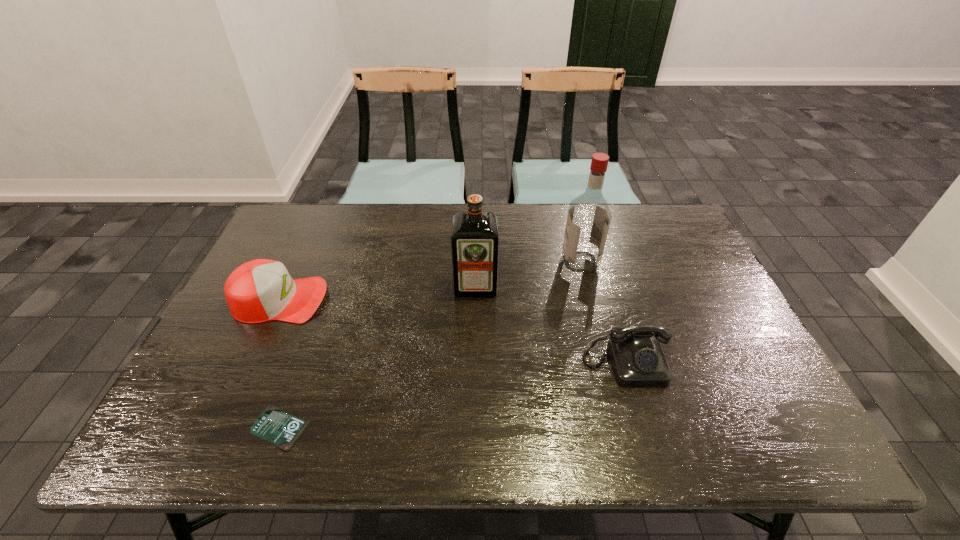
You are a GUI agent. You are given a task and a screenshot of the screen. Output one action in this format:
    pyautogui.click(x=<x>, y=<y>)
    Task: Click on the free spot located 0.240m on the front-facing side of the farthest object
    
    Given the screenshot: What is the action you would take?
    pyautogui.click(x=484, y=261)

Find the location of a particular element. This screenshot has width=960, height=540. vacant area situated 0.380m on the front-facing side of the farthest object is located at coordinates pyautogui.click(x=438, y=261).

In order to click on free space located on the front label of the third object from left to right in this screenshot , I will do `click(474, 366)`.

Where is `free location located on the front-facing side of the baseball cap`? This screenshot has width=960, height=540. free location located on the front-facing side of the baseball cap is located at coordinates (452, 300).

The image size is (960, 540). I want to click on vacant space located on the dial of the fourth tallest object, so pos(642,422).

Where is `free space located on the back of the nearest object`? free space located on the back of the nearest object is located at coordinates (316, 326).

Find the location of `object at the near edge`. object at the near edge is located at coordinates (274, 425).

Locate an element on the screen. The width and height of the screenshot is (960, 540). object that is at the left edge is located at coordinates (261, 290).

In the image, there is a desktop. In order to click on free space at the far edge in this screenshot , I will do `click(434, 218)`.

Find the location of a particular element. vacant space at the near edge is located at coordinates (662, 420).